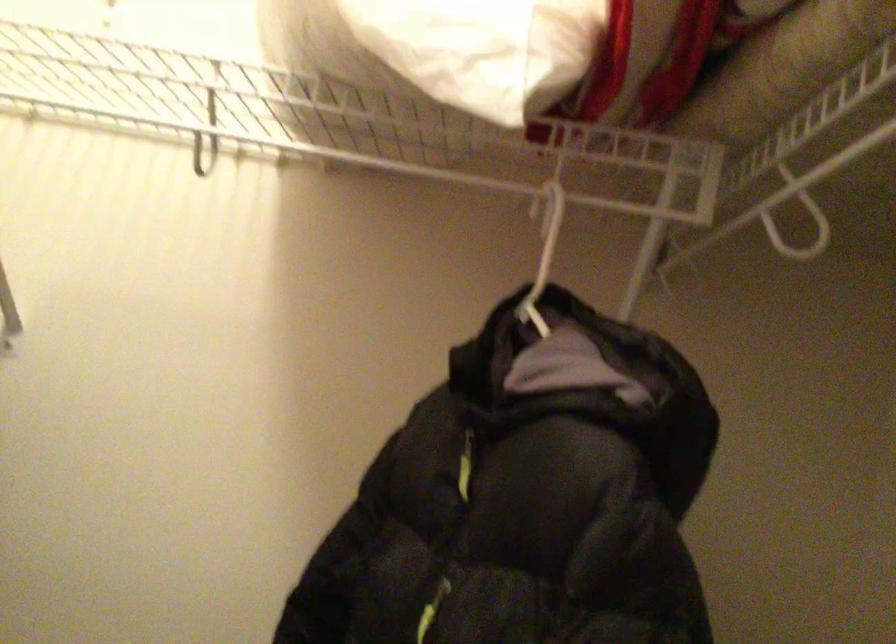
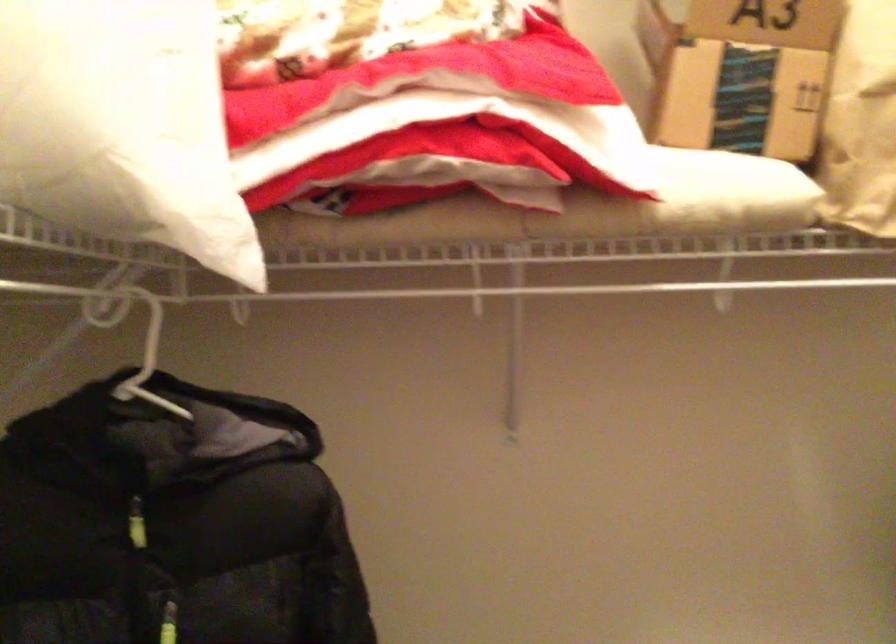
Question: The first image is from the beginning of the video and the second image is from the end. How did the camera likely rotate when shooting the video?

Choices:
 (A) Left
 (B) Right
 (C) Up
 (D) Down

Answer: (B)